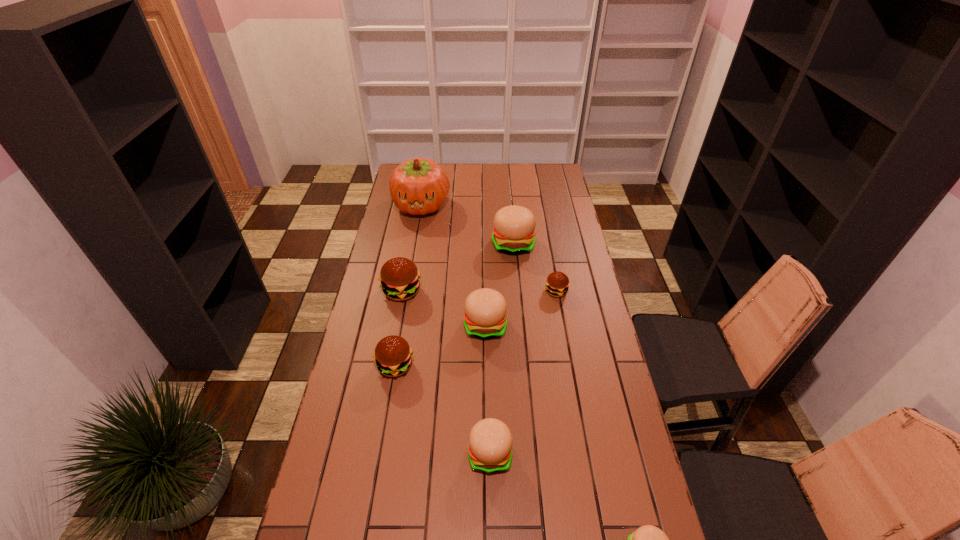
This screenshot has width=960, height=540. Identify the location of green pumpkin. (418, 186).

Identify the location of the farthest object. This screenshot has height=540, width=960. (418, 186).

Where is `the farthest hamburger`? the farthest hamburger is located at coordinates (513, 233).

This screenshot has height=540, width=960. I want to click on the second farthest object, so click(513, 233).

This screenshot has height=540, width=960. Find the location of `the biggest brown hamburger`. the biggest brown hamburger is located at coordinates (400, 280).

You are a GUI agent. You are given a task and a screenshot of the screen. Output one action in this format:
    pyautogui.click(x=<x>, y=<y>)
    Task: Click on the third smallest beige hamburger
    Image resolution: width=960 pixels, height=540 pixels.
    Given the screenshot: What is the action you would take?
    click(x=485, y=317)

The image size is (960, 540). I want to click on the third nearest beige hamburger, so click(485, 317).

At what (x,y) coordinates should I click in order to perform the action: click on the nearest brown hamburger. Please return your answer as a coordinate pair (x, y). Looking at the image, I should click on (393, 356).

You are a GUI agent. You are given a task and a screenshot of the screen. Output one action in this format:
    pyautogui.click(x=<x>, y=<y>)
    Task: Click on the second smallest brown hamburger
    Image resolution: width=960 pixels, height=540 pixels.
    Given the screenshot: What is the action you would take?
    pyautogui.click(x=393, y=356)

Identify the location of the third farthest beige hamburger. (490, 441).